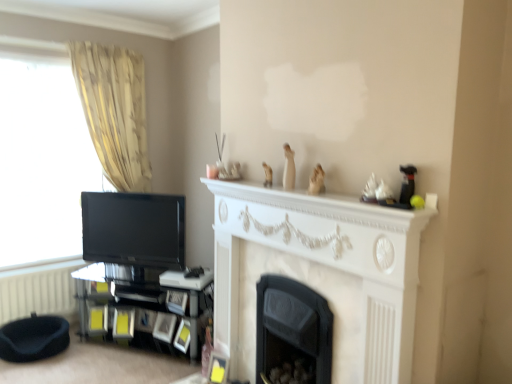
Question: Is black glass shelf at lower left smaller than beige fabric curtain at left?

Choices:
 (A) no
 (B) yes

Answer: (A)

Question: Is black glass shelf at lower left positioned beyond the bounds of beige fabric curtain at left?

Choices:
 (A) no
 (B) yes

Answer: (B)

Question: Considering the relative positions of black glass shelf at lower left and beige fabric curtain at left in the image provided, is black glass shelf at lower left in front of beige fabric curtain at left?

Choices:
 (A) no
 (B) yes

Answer: (B)

Question: From a real-world perspective, is black glass shelf at lower left on top of beige fabric curtain at left?

Choices:
 (A) no
 (B) yes

Answer: (A)

Question: Can you confirm if black glass shelf at lower left is wider than beige fabric curtain at left?

Choices:
 (A) no
 (B) yes

Answer: (B)

Question: From a real-world perspective, is black glass shelf at lower left beneath beige fabric curtain at left?

Choices:
 (A) yes
 (B) no

Answer: (A)

Question: From the image's perspective, does black glossy tv at left appear higher than beige fabric curtain at left?

Choices:
 (A) no
 (B) yes

Answer: (A)

Question: Would you say beige fabric curtain at left is part of black glossy tv at left's contents?

Choices:
 (A) yes
 (B) no

Answer: (B)

Question: Is black glossy tv at left next to beige fabric curtain at left?

Choices:
 (A) no
 (B) yes

Answer: (A)

Question: Is black glossy tv at left in front of beige fabric curtain at left?

Choices:
 (A) yes
 (B) no

Answer: (A)

Question: From a real-world perspective, is black glossy tv at left positioned under beige fabric curtain at left based on gravity?

Choices:
 (A) yes
 (B) no

Answer: (A)

Question: Is black glossy tv at left to the right of beige fabric curtain at left from the viewer's perspective?

Choices:
 (A) yes
 (B) no

Answer: (A)

Question: Would you consider black glossy tv at left to be distant from black fabric footrest at lower left?

Choices:
 (A) yes
 (B) no

Answer: (B)